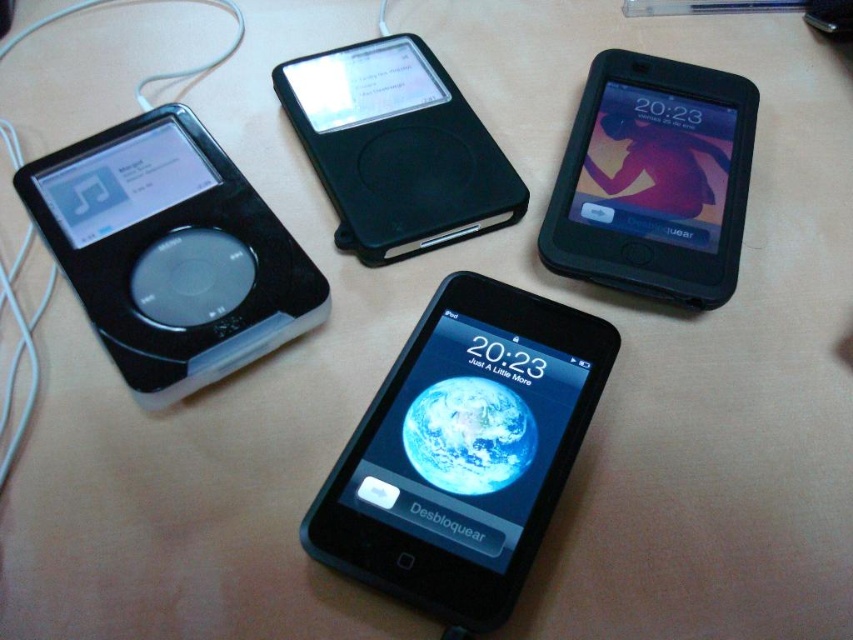
Based on the photo, who is more forward, (482,449) or (450,160)?

Point (482,449)

Between black matte phone at center and black matte ipod at upper center, which one has more height?

black matte phone at center

Where is `black matte phone at center`? This screenshot has height=640, width=853. black matte phone at center is located at coordinates (460, 488).

Where is `black matte phone at center`? The width and height of the screenshot is (853, 640). black matte phone at center is located at coordinates (460, 488).

Who is shorter, black rubberized phone at upper right or black matte ipod at upper center?

black matte ipod at upper center

Can you confirm if black rubberized phone at upper right is bigger than black matte ipod at upper center?

Correct, black rubberized phone at upper right is larger in size than black matte ipod at upper center.

The image size is (853, 640). What do you see at coordinates (654, 180) in the screenshot?
I see `black rubberized phone at upper right` at bounding box center [654, 180].

At what (x,y) coordinates should I click in order to perform the action: click on black rubberized phone at upper right. Please return your answer as a coordinate pair (x, y). Looking at the image, I should click on (654, 180).

Is point (415, 490) in front of point (292, 308)?

That is True.

Is black matte phone at center above black plastic ipod at left?

Actually, black matte phone at center is below black plastic ipod at left.

Does point (451, 328) come in front of point (93, 204)?

Yes.

I want to click on black matte phone at center, so click(460, 488).